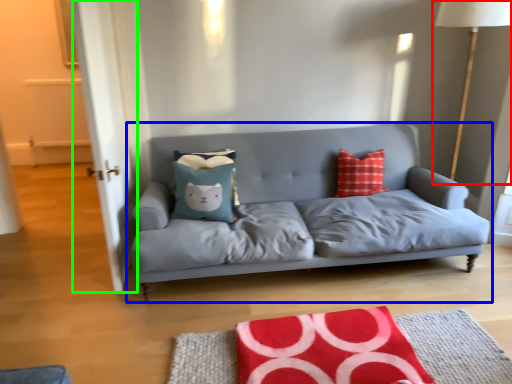
Question: Which is nearer to the table lamp (highlighted by a red box)? studio couch (highlighted by a blue box) or glass door (highlighted by a green box).

Choices:
 (A) studio couch
 (B) glass door

Answer: (A)